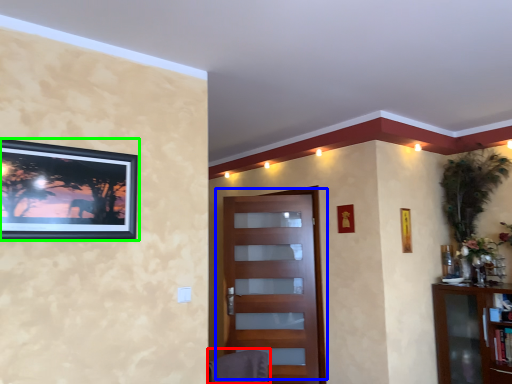
Question: Based on their relative distances, which object is farther from swivel chair (highlighted by a red box)? Choose from door (highlighted by a blue box) and picture frame (highlighted by a green box).

Choices:
 (A) door
 (B) picture frame

Answer: (A)